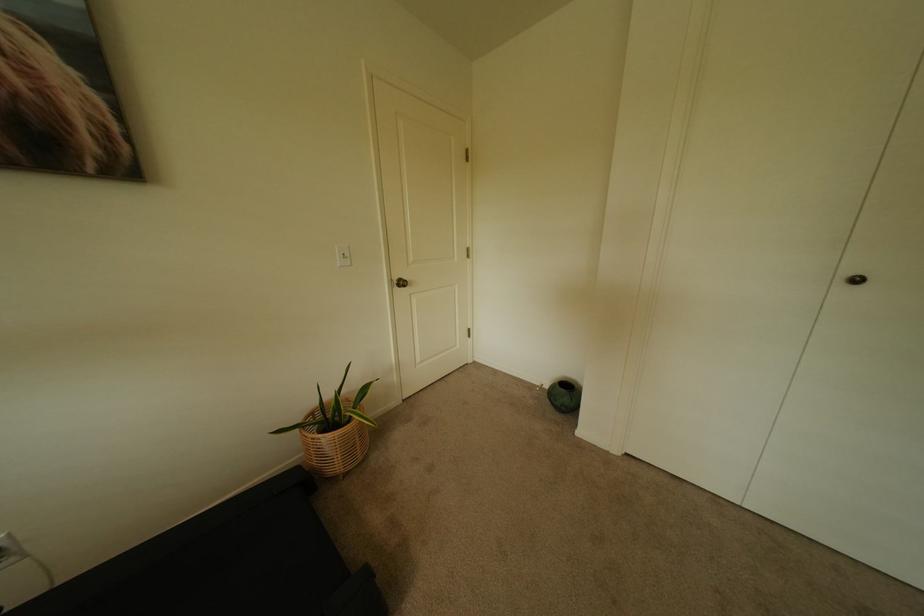
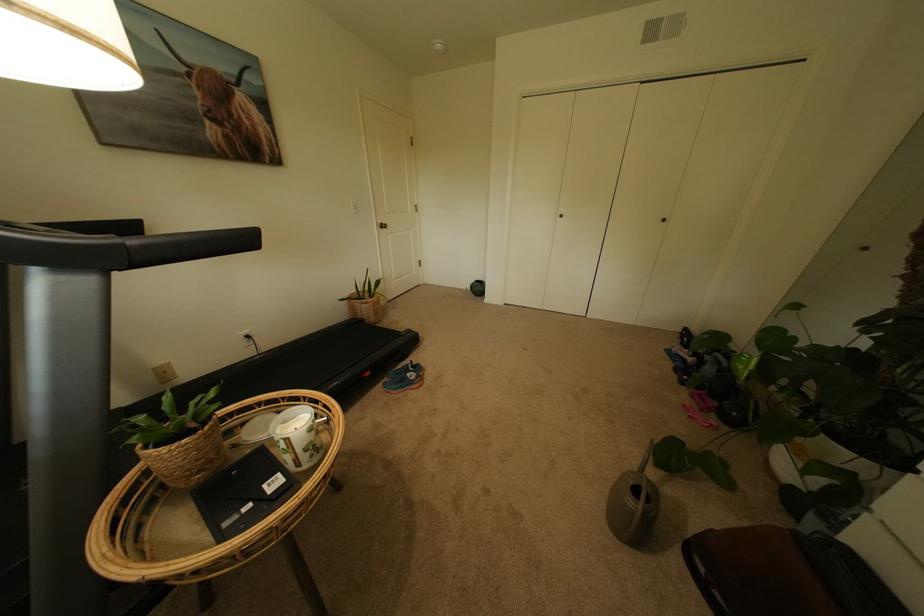
Locate, in the second image, the point that corresponds to (412,286) in the first image.

(394, 229)